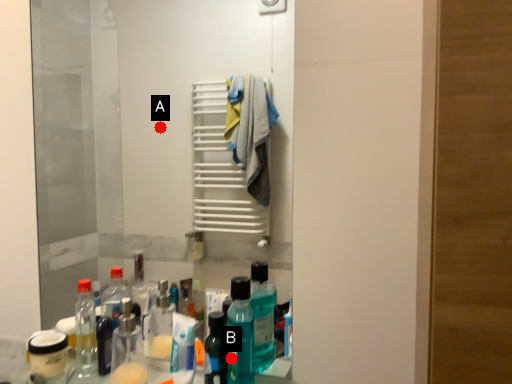
Question: Two points are circled on the image, labeled by A and B beside each circle. Among these points, which one is nearest to the camera?

Choices:
 (A) A is closer
 (B) B is closer

Answer: (B)